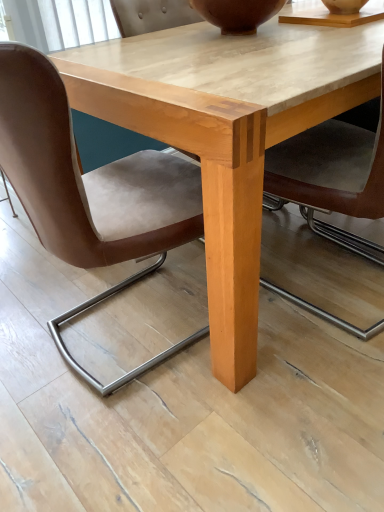
Locate an element on the screen. This screenshot has width=384, height=512. brown matte vase at upper center is located at coordinates click(x=237, y=14).

Identify the location of brown matte vase at upper center. (237, 14).

From the image's perspective, is brown matte vase at upper center located above light wood table at center?

Yes, from the image's perspective, brown matte vase at upper center is over light wood table at center.

Based on the photo, which is closer, (214,22) or (246,372)?

The point (246,372) is in front.

Considering the relative sizes of brown matte vase at upper center and light wood table at center in the image provided, is brown matte vase at upper center bigger than light wood table at center?

No, brown matte vase at upper center is not bigger than light wood table at center.

Does brown matte vase at upper center have a greater width compared to light wood table at center?

No.

From a real-world perspective, is brown leather chair at lower left under light wood table at center?

No, from a real-world perspective, brown leather chair at lower left is not under light wood table at center.

Would you say brown leather chair at lower left is to the left or to the right of light wood table at center in the picture?

Based on their positions, brown leather chair at lower left is located to the left of light wood table at center.

Can you tell me how much brown leather chair at lower left and light wood table at center differ in facing direction?

86.1 degrees.

How far apart are brown leather chair at lower left and light wood table at center?

They are 10.84 inches apart.

From the image's perspective, which one is positioned lower, brown leather chair at lower left or brown matte vase at upper center?

brown leather chair at lower left.

Is brown leather chair at lower left directly adjacent to brown matte vase at upper center?

No, brown leather chair at lower left is not making contact with brown matte vase at upper center.

From a real-world perspective, which object rests below the other?

In real-world perspective, brown leather chair at lower left is lower.

Image resolution: width=384 pixels, height=512 pixels. I want to click on chair on the left of brown matte vase at upper center, so click(x=89, y=191).

Is brown matte vase at upper center taller or shorter than brown leather chair at lower left?

brown matte vase at upper center is shorter than brown leather chair at lower left.

Which of these two, brown matte vase at upper center or brown leather chair at lower left, is thinner?

brown matte vase at upper center.

Would you say brown matte vase at upper center contains brown leather chair at lower left?

No, brown matte vase at upper center does not contain brown leather chair at lower left.

Is brown matte vase at upper center bigger or smaller than brown leather chair at lower left?

brown matte vase at upper center is smaller than brown leather chair at lower left.

Are light wood table at center and brown leather chair at lower left far apart?

No, light wood table at center is not far away from brown leather chair at lower left.

Is point (246, 302) behind point (54, 87)?

That is True.

From the image's perspective, which is below, light wood table at center or brown leather chair at lower left?

brown leather chair at lower left, from the image's perspective.

Which of these two, light wood table at center or brown leather chair at lower left, is thinner?

Thinner between the two is brown leather chair at lower left.

From a real-world perspective, who is located higher, light wood table at center or brown matte vase at upper center?

brown matte vase at upper center is physically above.

Looking at this image, is light wood table at center placed right next to brown matte vase at upper center?

They are not placed beside each other.

You are a GUI agent. You are given a task and a screenshot of the screen. Output one action in this format:
    pyautogui.click(x=<x>, y=<y>)
    Task: Click on the coffee table located below the brown matte vase at upper center (from the image's perspective)
    The height and width of the screenshot is (512, 384).
    Given the screenshot: What is the action you would take?
    pyautogui.click(x=227, y=132)

The height and width of the screenshot is (512, 384). Identify the location of coffee table that is on the right side of brown leather chair at lower left. (227, 132).

Looking at the image, which one is located further to brown leather chair at lower left, brown matte vase at upper center or light wood table at center?

Among the two, brown matte vase at upper center is located further to brown leather chair at lower left.

From the image, which object appears to be farther from brown matte vase at upper center, light wood table at center or brown leather chair at lower left?

brown leather chair at lower left.

Considering their positions, is light wood table at center positioned closer to brown leather chair at lower left than brown matte vase at upper center?

Among the two, light wood table at center is located nearer to brown leather chair at lower left.

Which object lies nearer to the anchor point brown matte vase at upper center, brown leather chair at lower left or light wood table at center?

The object closer to brown matte vase at upper center is light wood table at center.

Estimate the real-world distances between objects in this image. Which object is further from light wood table at center, brown matte vase at upper center or brown leather chair at lower left?

brown matte vase at upper center.

From the image, which object appears to be farther from light wood table at center, brown leather chair at lower left or brown matte vase at upper center?

brown matte vase at upper center lies further to light wood table at center than the other object.

The width and height of the screenshot is (384, 512). What are the coordinates of `vase situated between brown leather chair at lower left and light wood table at center from left to right` in the screenshot? It's located at click(237, 14).